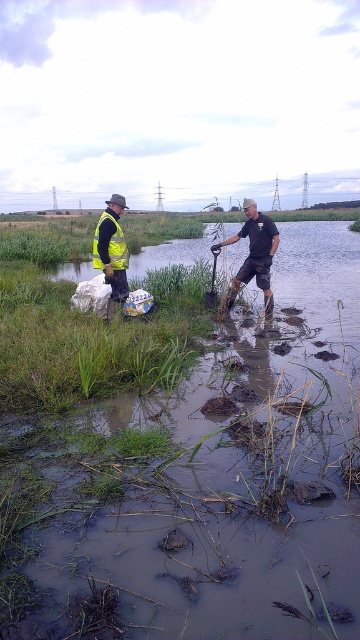
You are a drone operator trying to capture a photo of the two workers in the scene. The drone is currently positioned above the scene. Which of the two points, point 1 at coordinates (303, 320) or point 2 at coordinates (105, 216), is closer to the drone?

Point 2 at coordinates (105, 216) is closer to the drone because it is closer to the camera than point 1 at coordinates (303, 320).

Consider the image. You are standing at the edge of the water and see two points marked in the scene. One is at coordinate point (x=235, y=237) and the other at point (x=111, y=291). Which point is closer to you?

Point (x=111, y=291) is closer to you because it is less further to the viewer than point (x=235, y=237).

You are a safety inspector reviewing this scene. The safety protocol requires that all workers must wear their safety vests within 0.5 meters of the water edge to ensure visibility. The coordinates provided are in a normalized system where the bottom left corner is the origin. Is the matte yellow vest at left positioned within the required safety zone?

The matte yellow vest at left is positioned at coordinates (183, 461). Since the safety zone requires vests to be within 0.5 meters of the water edge, and the coordinates are normalized with the origin at the bottom left corner, the exact distance cannot be determined without additional scaling information. However, based on the coordinate system provided, the vest is located at the specified point, but compliance with the safety protocol cannot be confirmed without knowing the actual dimensions of the 0.